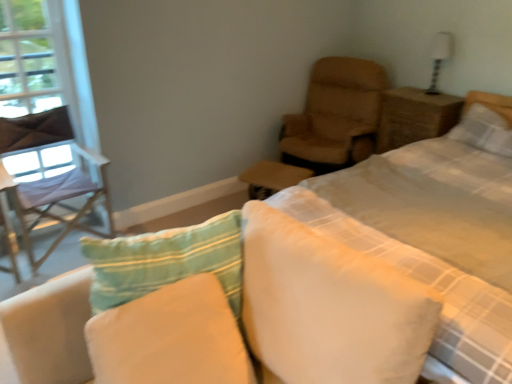
Question: Does point (168, 292) appear closer or farther from the camera than point (436, 59)?

Choices:
 (A) farther
 (B) closer

Answer: (B)

Question: Is soft cotton pillow at center, the first pillow positioned from the left, to the left or to the right of white glossy table lamp at upper right in the image?

Choices:
 (A) right
 (B) left

Answer: (B)

Question: Which object is positioned closest to the brown leather ottoman at center?

Choices:
 (A) transparent plastic window screen at left
 (B) leather-like tan chair at upper right, the first chair in the right-to-left sequence
 (C) white soft pillow at center, positioned as the 2th pillow in front-to-back order
 (D) white glossy table lamp at upper right
 (E) white checkered quilt at upper right

Answer: (B)

Question: Which object is the closest to the white glossy table lamp at upper right?

Choices:
 (A) brown wicker nightstand at upper right
 (B) brown leather ottoman at center
 (C) transparent plastic window screen at left
 (D) white soft pillow at center, which is the second pillow in top-to-bottom order
 (E) white textured pillow at upper right, which is the 1th pillow from top to bottom

Answer: (A)